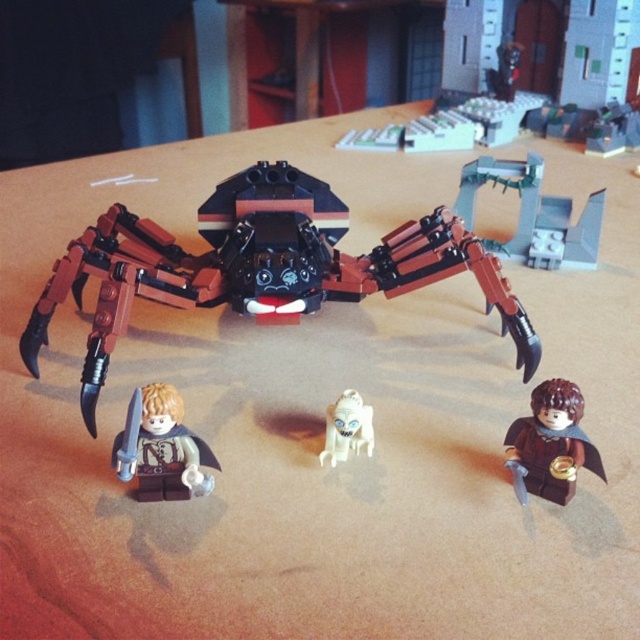
Who is positioned more to the left, brick-like spider at center or white matte ghost at center?

brick-like spider at center is more to the left.

Which is in front, point (237, 173) or point (371, 422)?

Point (371, 422)

Find the location of `brick-like spider at center`. brick-like spider at center is located at coordinates point(259,266).

Looking at this image, does brick-like spider at center have a greater width compared to smooth plastic minifigure at lower left?

Indeed, brick-like spider at center has a greater width compared to smooth plastic minifigure at lower left.

Does brick-like spider at center appear over smooth plastic minifigure at lower left?

Yes.

Which is behind, point (243, 252) or point (154, 460)?

The point (243, 252) is more distant.

Locate an element on the screen. Image resolution: width=640 pixels, height=640 pixels. brick-like spider at center is located at coordinates (259, 266).

Does point (67, 282) come farther from viewer compared to point (508, 241)?

That is False.

Is brick-like spider at center further to camera compared to gray metallic structure at upper right?

No, it is not.

Is point (369, 256) in front of point (589, 195)?

Yes, point (369, 256) is in front of point (589, 195).

This screenshot has height=640, width=640. Identify the location of brick-like spider at center. (259, 266).